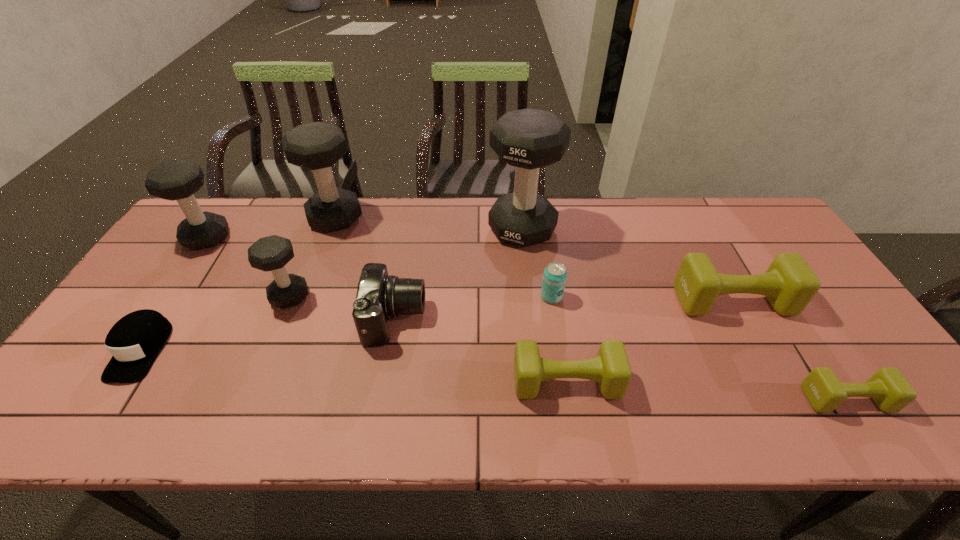
You are a GUI agent. You are given a task and a screenshot of the screen. Output one action in this format:
    pyautogui.click(x=<x>, y=<y>)
    Task: Click on the free space that is in between the shortest dumbbell and the beer can
    Image resolution: width=960 pixels, height=540 pixels.
    Given the screenshot: What is the action you would take?
    [x=699, y=348]

Image resolution: width=960 pixels, height=540 pixels. I want to click on empty location between the black cap and the farthest olive dumbbell, so click(x=437, y=326).

Locate an element on the screen. Image resolution: width=960 pixels, height=540 pixels. free space that is in between the biggest gray dumbbell and the fourth shortest dumbbell is located at coordinates (406, 262).

Find the location of a particular element. The width and height of the screenshot is (960, 540). vacant space that is in between the sixth shortest dumbbell and the tallest object is located at coordinates tap(429, 224).

This screenshot has height=540, width=960. I want to click on object that can be found as the eighth closest to the second tallest object, so click(789, 284).

You are a GUI agent. You are given a task and a screenshot of the screen. Output one action in this format:
    pyautogui.click(x=<x>, y=<y>)
    Task: Click on the object that stands as the second closest to the biggest gray dumbbell
    This screenshot has height=540, width=960.
    Given the screenshot: What is the action you would take?
    pyautogui.click(x=379, y=296)

Locate an element on the screen. This screenshot has height=540, width=960. dumbbell that is the closest to the shortest dumbbell is located at coordinates (789, 284).

Identify which dumbbell is located as the fifth nearest to the black cap. Please provide its 2D coordinates. Your answer should be formatted as a tuple, i.e. [(x, y)], where the tuple contains the x and y coordinates of a point satisfying the conditions above.

[(611, 369)]

This screenshot has width=960, height=540. What are the coordinates of `gray dumbbell that is the second closest one to the beer can` in the screenshot? It's located at (317, 146).

The image size is (960, 540). In order to click on the second closest gray dumbbell to the third smallest gray dumbbell in this screenshot , I will do `click(178, 180)`.